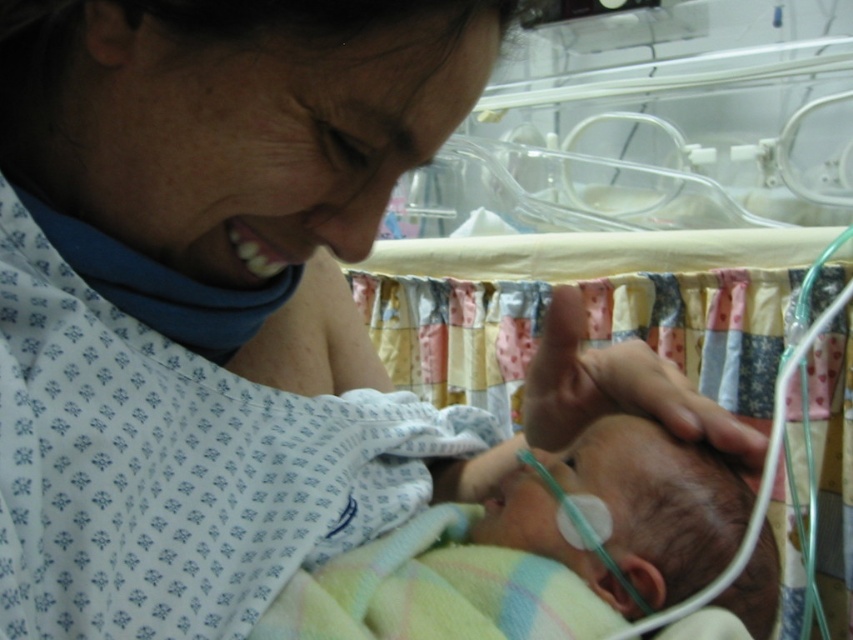
You are a nurse in a hospital. You need to move the smooth skin newborn at center to the patchwork fabric infant bed at center. Can you safely move the newborn to the bed without needing assistance?

The distance between the patchwork fabric infant bed at center and the smooth skin newborn at center is 1.29 meters. Since this distance is manageable for a nurse to handle alone, you can safely move the newborn to the bed without needing assistance.

You are a nurse in the hospital. You need to place a small medical device on the bed that is 1.5 meters away from the camera. The device must be placed at the point marked as point (817, 397). Can you safely place the device there?

Point (817, 397) is 1.43 meters away from the camera, so the device cannot be placed there since it is closer than the required 1.5 meters.